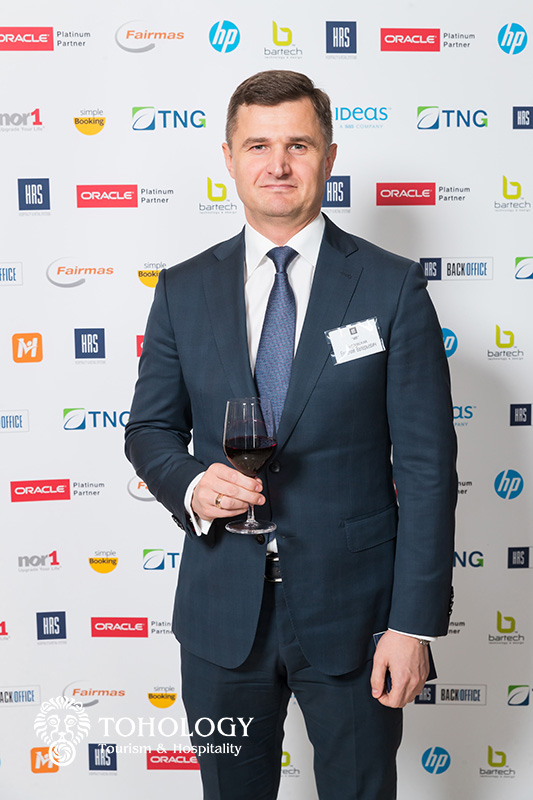
Where is `glass of red wine`? glass of red wine is located at coordinates (243, 453).